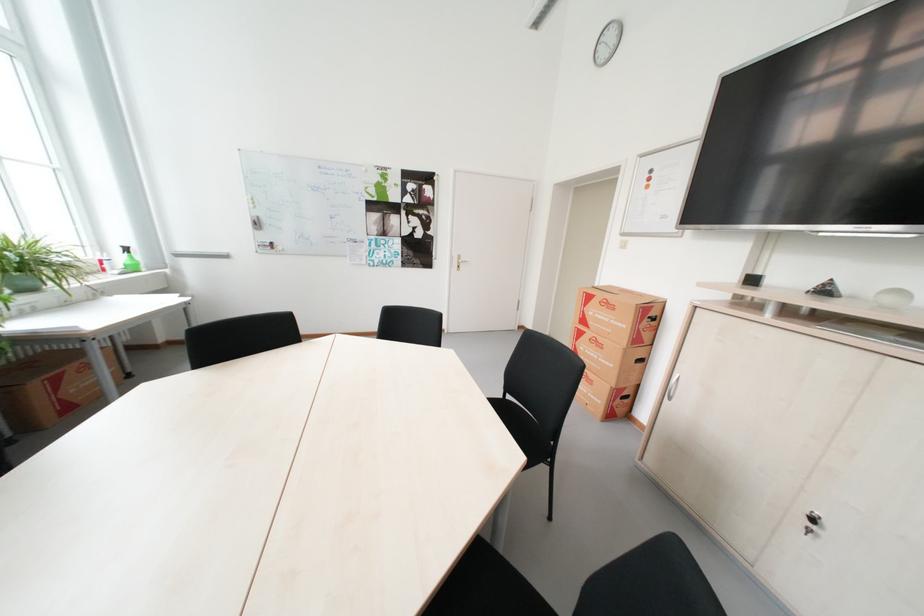
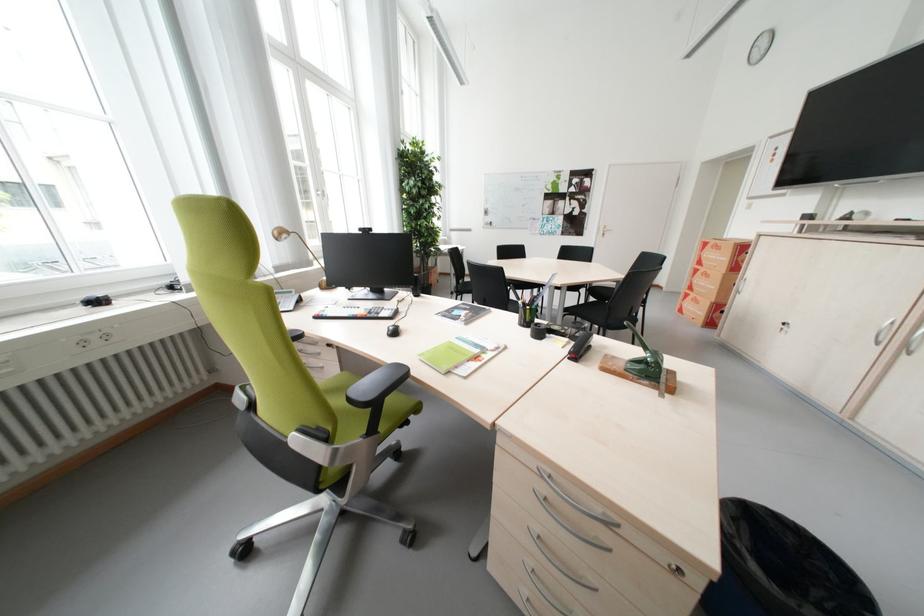
In the second image, find the point that corresponds to pixel 590 334 in the first image.

(706, 272)